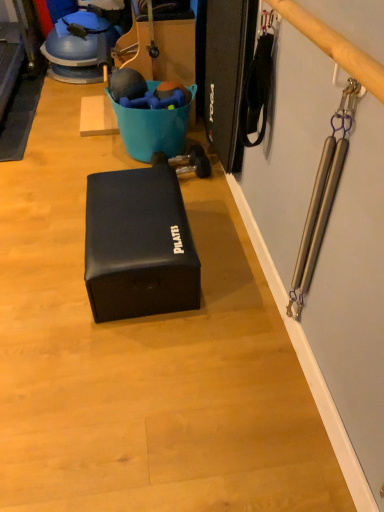
Find the location of a particular element. The width and height of the screenshot is (384, 512). free space that is to the left of black leather box at center is located at coordinates (43, 252).